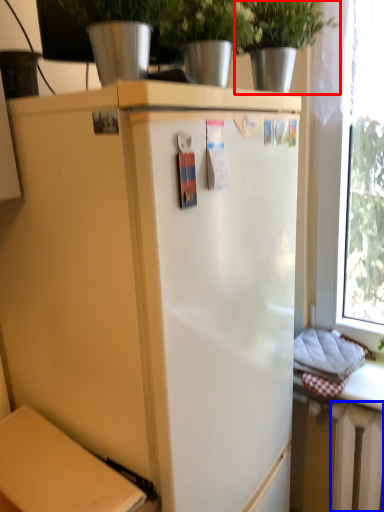
Question: Which object appears closest to the camera in this image, houseplant (highlighted by a red box) or radiator (highlighted by a blue box)?

Choices:
 (A) houseplant
 (B) radiator

Answer: (A)